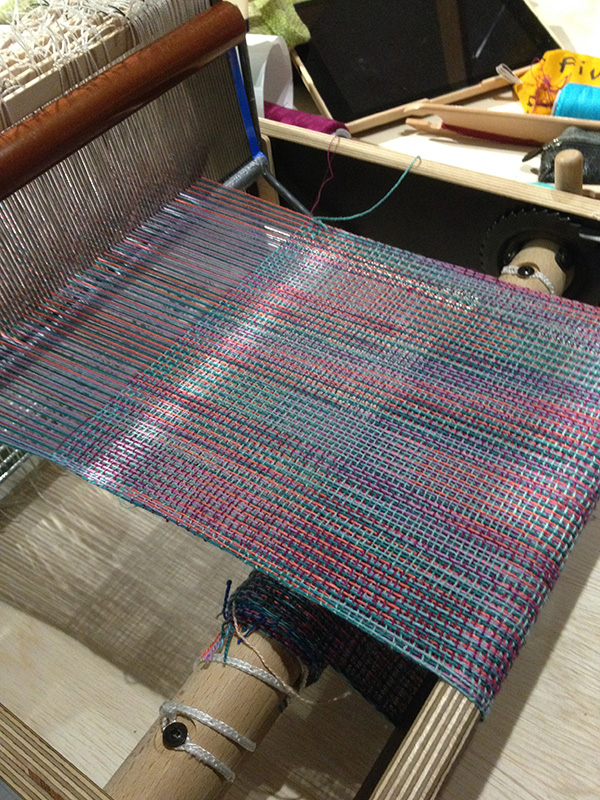
Locate an element on the screen. green rag is located at coordinates (280, 18).